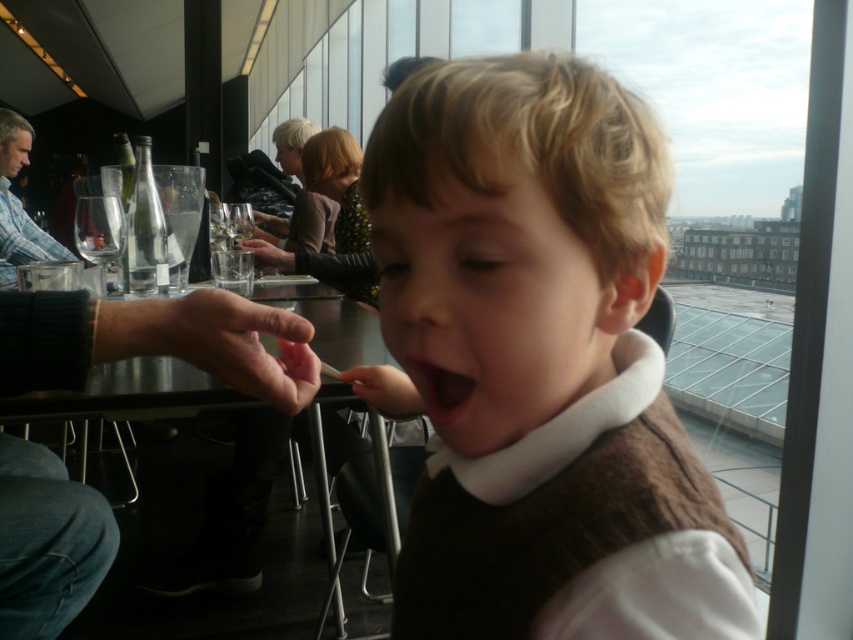
Is metallic silver table at center bigger than black matte mouth at center?

Yes.

Is metallic silver table at center below black matte mouth at center?

Indeed, metallic silver table at center is positioned under black matte mouth at center.

Measure the distance between point (77, 412) and camera.

They are 34.32 inches apart.

You are a GUI agent. You are given a task and a screenshot of the screen. Output one action in this format:
    pyautogui.click(x=<x>, y=<y>)
    Task: Click on the metallic silver table at center
    
    Given the screenshot: What is the action you would take?
    pyautogui.click(x=142, y=392)

Is brown fuzzy vest at center positioned before metallic silver table at center?

That is True.

Who is more forward, (703,630) or (291,321)?

Point (703,630)

Locate an element on the screen. brown fuzzy vest at center is located at coordinates (543, 362).

Does plaid shirt at left have a lesser width compared to black matte mouth at center?

No, plaid shirt at left is not thinner than black matte mouth at center.

Who is more distant from viewer, (13, 276) or (430, 408)?

The point (13, 276) is more distant.

At what (x,y) coordinates should I click in order to perform the action: click on plaid shirt at left. Please return your answer as a coordinate pair (x, y). The width and height of the screenshot is (853, 640). Looking at the image, I should click on (19, 204).